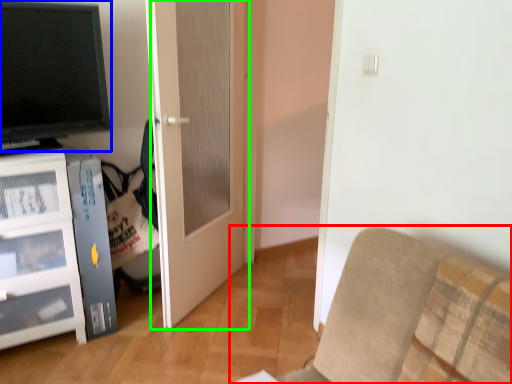
Question: Estimate the real-world distances between objects in this image. Which object is closer to furniture (highlighted by a red box), television (highlighted by a blue box) or door (highlighted by a green box)?

Choices:
 (A) television
 (B) door

Answer: (B)